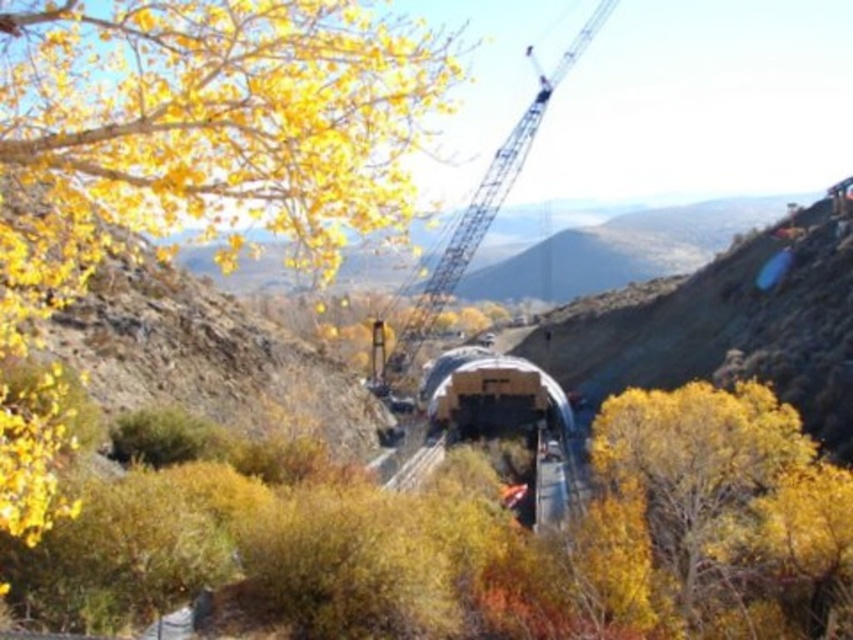
Question: Can you confirm if metallic silver train at center is positioned above metallic gray crane at upper center?

Choices:
 (A) yes
 (B) no

Answer: (B)

Question: Is the position of yellow leafy tree at upper left more distant than that of metallic gray crane at upper center?

Choices:
 (A) yes
 (B) no

Answer: (B)

Question: Estimate the real-world distances between objects in this image. Which object is farther from the yellow leafy tree at upper left?

Choices:
 (A) metallic silver train at center
 (B) metallic gray crane at upper center

Answer: (B)

Question: Can you confirm if metallic silver train at center is positioned to the left of metallic gray crane at upper center?

Choices:
 (A) yes
 (B) no

Answer: (A)

Question: Which object is the closest to the metallic silver train at center?

Choices:
 (A) yellow matte tree at center
 (B) yellow leafy tree at upper left
 (C) metallic gray crane at upper center

Answer: (A)

Question: Which of these objects is positioned closest to the yellow matte tree at center?

Choices:
 (A) metallic gray crane at upper center
 (B) yellow leafy tree at upper left
 (C) metallic silver train at center

Answer: (C)